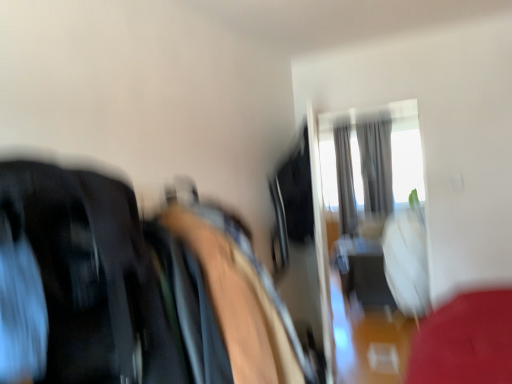
Question: Is gray fabric curtain at upper right, which appears as the 2th curtain when viewed from the left, thinner than silky gray curtain at upper center, placed as the 2th curtain when sorted from right to left?

Choices:
 (A) no
 (B) yes

Answer: (B)

Question: Is gray fabric curtain at upper right, which appears as the 2th curtain when viewed from the left, behind silky gray curtain at upper center, acting as the 1th curtain starting from the left?

Choices:
 (A) no
 (B) yes

Answer: (A)

Question: Is gray fabric curtain at upper right, which appears as the 2th curtain when viewed from the left, located outside silky gray curtain at upper center, placed as the 2th curtain when sorted from right to left?

Choices:
 (A) yes
 (B) no

Answer: (A)

Question: From the image's perspective, is gray fabric curtain at upper right, which appears as the 2th curtain when viewed from the left, above silky gray curtain at upper center, placed as the 2th curtain when sorted from right to left?

Choices:
 (A) yes
 (B) no

Answer: (A)

Question: Could you tell me if gray fabric curtain at upper right, the 1th curtain from the right, is facing silky gray curtain at upper center, placed as the 2th curtain when sorted from right to left?

Choices:
 (A) yes
 (B) no

Answer: (B)

Question: Looking at their shapes, would you say gray fabric curtain at upper right, the 1th curtain from the right, is wider or thinner than silky gray curtain at upper center, acting as the 1th curtain starting from the left?

Choices:
 (A) thin
 (B) wide

Answer: (A)

Question: Considering the positions of point (382, 157) and point (344, 205), is point (382, 157) closer or farther from the camera than point (344, 205)?

Choices:
 (A) closer
 (B) farther

Answer: (B)

Question: From a real-world perspective, is gray fabric curtain at upper right, which appears as the 2th curtain when viewed from the left, physically located above or below silky gray curtain at upper center, placed as the 2th curtain when sorted from right to left?

Choices:
 (A) below
 (B) above

Answer: (B)

Question: Considering their positions, is gray fabric curtain at upper right, which appears as the 2th curtain when viewed from the left, located in front of or behind silky gray curtain at upper center, acting as the 1th curtain starting from the left?

Choices:
 (A) front
 (B) behind

Answer: (A)

Question: Is point (379, 210) closer or farther from the camera than point (391, 190)?

Choices:
 (A) farther
 (B) closer

Answer: (B)

Question: Considering the positions of gray fabric curtain at upper right, the 1th curtain from the right, and transparent glass door at upper center in the image, is gray fabric curtain at upper right, the 1th curtain from the right, taller or shorter than transparent glass door at upper center?

Choices:
 (A) short
 (B) tall

Answer: (A)

Question: Is gray fabric curtain at upper right, the 1th curtain from the right, spatially inside transparent glass door at upper center, or outside of it?

Choices:
 (A) outside
 (B) inside

Answer: (A)

Question: In terms of size, does gray fabric curtain at upper right, the 1th curtain from the right, appear bigger or smaller than transparent glass door at upper center?

Choices:
 (A) small
 (B) big

Answer: (B)

Question: In terms of size, does beige fabric bean bag chair at center appear bigger or smaller than transparent glass door at upper center?

Choices:
 (A) big
 (B) small

Answer: (A)

Question: Is beige fabric bean bag chair at center situated inside transparent glass door at upper center or outside?

Choices:
 (A) inside
 (B) outside

Answer: (B)